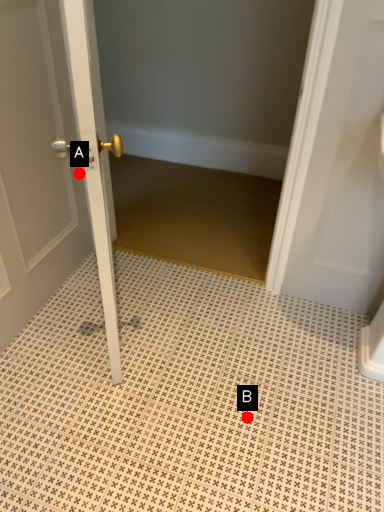
Question: Two points are circled on the image, labeled by A and B beside each circle. Among these points, which one is nearest to the camera?

Choices:
 (A) A is closer
 (B) B is closer

Answer: (B)